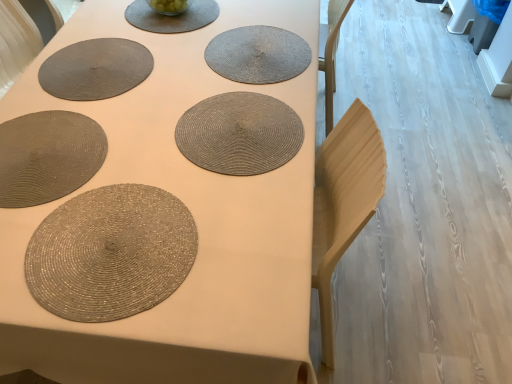
You are a GUI agent. You are given a task and a screenshot of the screen. Output one action in this format:
    pyautogui.click(x=<x>, y=<y>)
    Task: Click on the free area in between rattan placemat at lower left, the second paper plate viewed from the top, and shiny metallic placemat at bottom left, the 1th paper plate in the bottom-to-top sequence
    
    Given the screenshot: What is the action you would take?
    pyautogui.click(x=102, y=180)